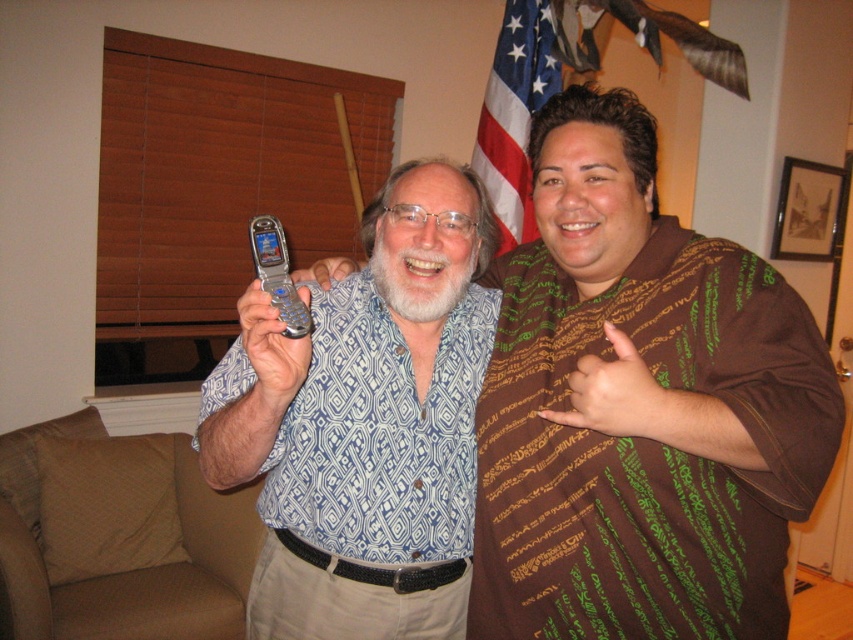
You are a photographer trying to capture a photo of both the silver metallic flip phone at center and the silver metallic phone at center. Which one is located to the right of the other?

The silver metallic flip phone at center is positioned on the right side of silver metallic phone at center.

You are trying to place both the metallic silver flip phone at center and the silver metallic phone at center into a phone case that can only accommodate one phone at a time. Based on their sizes, which phone might require a larger case?

The metallic silver flip phone at center might require a larger case since it might be wider than the silver metallic phone at center.

You are a photographer setting up a shoot in this living room. You need to position a new camera so it can capture both the silver metallic flip phone at center and the american flag at upper center in the same frame. Based on their positions, which object should be placed closer to the left side of the camera frame?

The silver metallic flip phone at center should be placed closer to the left side of the camera frame because it is positioned to the left of the american flag at upper center.